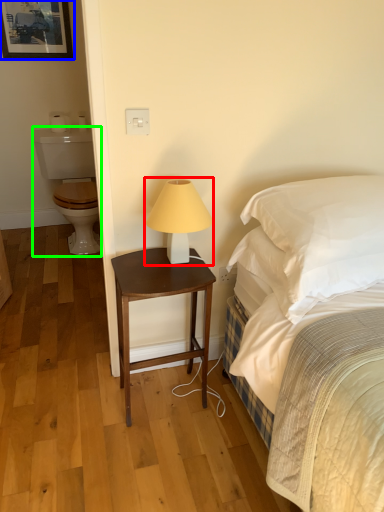
Question: Which object is the closest to the table lamp (highlighted by a red box)? Choose among these: picture frame (highlighted by a blue box) or sit (highlighted by a green box).

Choices:
 (A) picture frame
 (B) sit

Answer: (B)